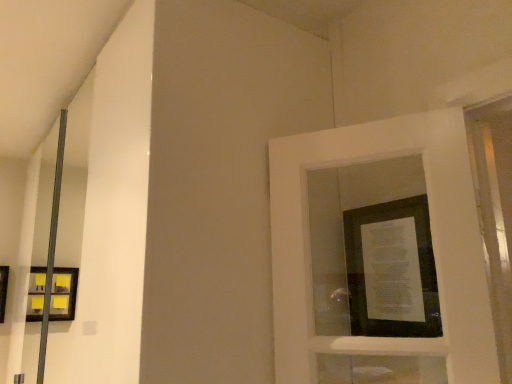
Question: Based on their positions, is matte black picture frame at center, which is the 2th picture frame in bottom-to-top order, located to the left or right of matte black picture frame at left, which is counted as the first picture frame, starting from the left?

Choices:
 (A) right
 (B) left

Answer: (A)

Question: Is matte black picture frame at center, which appears as the 1th picture frame when viewed from the top, taller or shorter than matte black picture frame at left, the 2th picture frame from the front?

Choices:
 (A) tall
 (B) short

Answer: (A)

Question: From a real-world perspective, is matte black picture frame at center, the 2th picture frame viewed from the left, above or below matte black picture frame at left, which appears as the first picture frame when ordered from the bottom?

Choices:
 (A) below
 (B) above

Answer: (B)

Question: From a real-world perspective, is matte black picture frame at left, which is counted as the first picture frame, starting from the left, above or below matte black picture frame at center, the 2th picture frame viewed from the left?

Choices:
 (A) above
 (B) below

Answer: (B)

Question: Considering their positions, is matte black picture frame at left, which is counted as the first picture frame, starting from the left, located in front of or behind matte black picture frame at center, which appears as the 1th picture frame when viewed from the top?

Choices:
 (A) front
 (B) behind

Answer: (B)

Question: Is matte black picture frame at left, the 2th picture frame from the front, to the left or to the right of matte black picture frame at center, which appears as the 1th picture frame when viewed from the top, in the image?

Choices:
 (A) right
 (B) left

Answer: (B)

Question: Is matte black picture frame at left, which is counted as the first picture frame, starting from the left, bigger or smaller than matte black picture frame at center, which appears as the 1th picture frame when viewed from the top?

Choices:
 (A) small
 (B) big

Answer: (B)